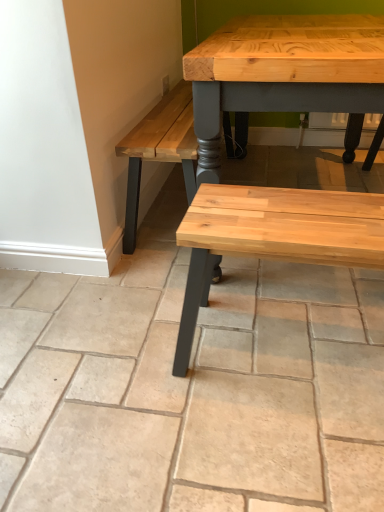
Identify the location of free region under natural wood bench at center (from a real-world perspective). (291, 347).